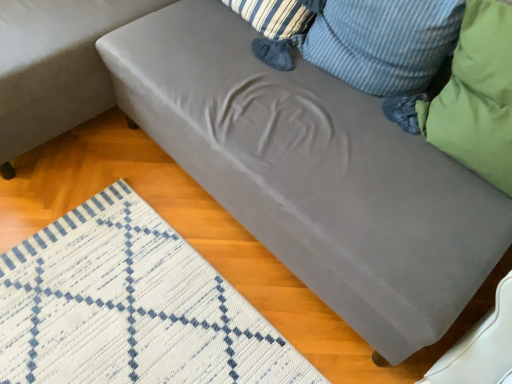
Question: From a real-world perspective, is green fabric pillow at right, which is counted as the 1th pillow, starting from the right, on satin gray couch at lower right?

Choices:
 (A) yes
 (B) no

Answer: (A)

Question: Is green fabric pillow at right, which ranks as the second pillow in left-to-right order, taller than satin gray couch at lower right?

Choices:
 (A) no
 (B) yes

Answer: (A)

Question: From a real-world perspective, is green fabric pillow at right, which is counted as the 1th pillow, starting from the right, located beneath satin gray couch at lower right?

Choices:
 (A) no
 (B) yes

Answer: (A)

Question: Is green fabric pillow at right, which is counted as the 1th pillow, starting from the right, outside satin gray couch at lower right?

Choices:
 (A) no
 (B) yes

Answer: (B)

Question: Does green fabric pillow at right, which is counted as the 1th pillow, starting from the right, appear on the left side of satin gray couch at lower right?

Choices:
 (A) yes
 (B) no

Answer: (B)

Question: From the image's perspective, relative to green fabric pillow at right, which is counted as the 1th pillow, starting from the right, is green fabric pillow at upper right, positioned as the second pillow in right-to-left order, above or below?

Choices:
 (A) above
 (B) below

Answer: (A)

Question: Considering the positions of green fabric pillow at upper right, acting as the 1th pillow starting from the left, and green fabric pillow at right, which is counted as the 1th pillow, starting from the right, in the image, is green fabric pillow at upper right, acting as the 1th pillow starting from the left, taller or shorter than green fabric pillow at right, which is counted as the 1th pillow, starting from the right,?

Choices:
 (A) tall
 (B) short

Answer: (B)

Question: Is green fabric pillow at upper right, acting as the 1th pillow starting from the left, in front of or behind green fabric pillow at right, which ranks as the second pillow in left-to-right order, in the image?

Choices:
 (A) front
 (B) behind

Answer: (B)

Question: Is green fabric pillow at upper right, positioned as the second pillow in right-to-left order, to the left or to the right of green fabric pillow at right, which is counted as the 1th pillow, starting from the right, in the image?

Choices:
 (A) left
 (B) right

Answer: (A)

Question: From a real-world perspective, is green fabric pillow at right, which is counted as the 1th pillow, starting from the right, above or below satin gray couch at lower right?

Choices:
 (A) below
 (B) above

Answer: (B)

Question: Would you say green fabric pillow at right, which is counted as the 1th pillow, starting from the right, is inside or outside satin gray couch at lower right?

Choices:
 (A) inside
 (B) outside

Answer: (B)

Question: Is point (452, 57) closer or farther from the camera than point (13, 79)?

Choices:
 (A) closer
 (B) farther

Answer: (A)

Question: Is green fabric pillow at right, which ranks as the second pillow in left-to-right order, to the left or to the right of satin gray couch at lower right in the image?

Choices:
 (A) left
 (B) right

Answer: (B)

Question: Looking at their shapes, would you say satin gray couch at lower right is wider or thinner than green fabric pillow at upper right, acting as the 1th pillow starting from the left?

Choices:
 (A) wide
 (B) thin

Answer: (A)

Question: From a real-world perspective, is satin gray couch at lower right positioned above or below green fabric pillow at upper right, acting as the 1th pillow starting from the left?

Choices:
 (A) below
 (B) above

Answer: (A)